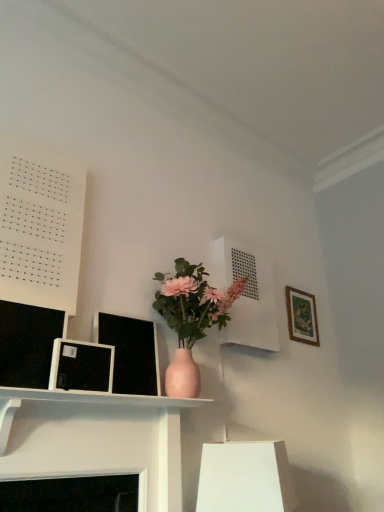
Question: From the image's perspective, would you say matte black picture frame at left, the second picture frame when ordered from right to left, is shown under white paper at upper left?

Choices:
 (A) yes
 (B) no

Answer: (A)

Question: Considering the relative positions of matte black picture frame at left, placed as the first picture frame when sorted from left to right, and white paper at upper left in the image provided, is matte black picture frame at left, placed as the first picture frame when sorted from left to right, to the left of white paper at upper left from the viewer's perspective?

Choices:
 (A) no
 (B) yes

Answer: (A)

Question: From a real-world perspective, is matte black picture frame at left, which ranks as the 1th picture frame in front-to-back order, below white paper at upper left?

Choices:
 (A) no
 (B) yes

Answer: (B)

Question: Is there a large distance between matte black picture frame at left, which ranks as the 1th picture frame in front-to-back order, and white paper at upper left?

Choices:
 (A) yes
 (B) no

Answer: (B)

Question: Is matte black picture frame at left, which ranks as the 1th picture frame in front-to-back order, positioned with its back to white paper at upper left?

Choices:
 (A) yes
 (B) no

Answer: (B)

Question: Is matte black picture frame at left, placed as the second picture frame when sorted from back to front, smaller than white paper at upper left?

Choices:
 (A) no
 (B) yes

Answer: (B)

Question: From a real-world perspective, is white paper at upper left on top of wooden picture frame at upper right, the first picture frame positioned from the right?

Choices:
 (A) yes
 (B) no

Answer: (A)

Question: Is the depth of white paper at upper left greater than that of wooden picture frame at upper right, the first picture frame positioned from the right?

Choices:
 (A) yes
 (B) no

Answer: (B)

Question: From the image's perspective, is white paper at upper left on top of wooden picture frame at upper right, which ranks as the 2th picture frame in front-to-back order?

Choices:
 (A) no
 (B) yes

Answer: (B)

Question: Considering the relative positions of white paper at upper left and wooden picture frame at upper right, the second picture frame from the left, in the image provided, is white paper at upper left to the right of wooden picture frame at upper right, the second picture frame from the left, from the viewer's perspective?

Choices:
 (A) no
 (B) yes

Answer: (A)

Question: Is white paper at upper left positioned far away from wooden picture frame at upper right, which ranks as the 2th picture frame in front-to-back order?

Choices:
 (A) no
 (B) yes

Answer: (B)

Question: Is white paper at upper left thinner than wooden picture frame at upper right, the first picture frame positioned from the right?

Choices:
 (A) yes
 (B) no

Answer: (B)

Question: Is matte white shelf at center, placed as the 2th shelf when sorted from back to front, behind wooden picture frame at upper right, which ranks as the 2th picture frame in front-to-back order?

Choices:
 (A) yes
 (B) no

Answer: (B)